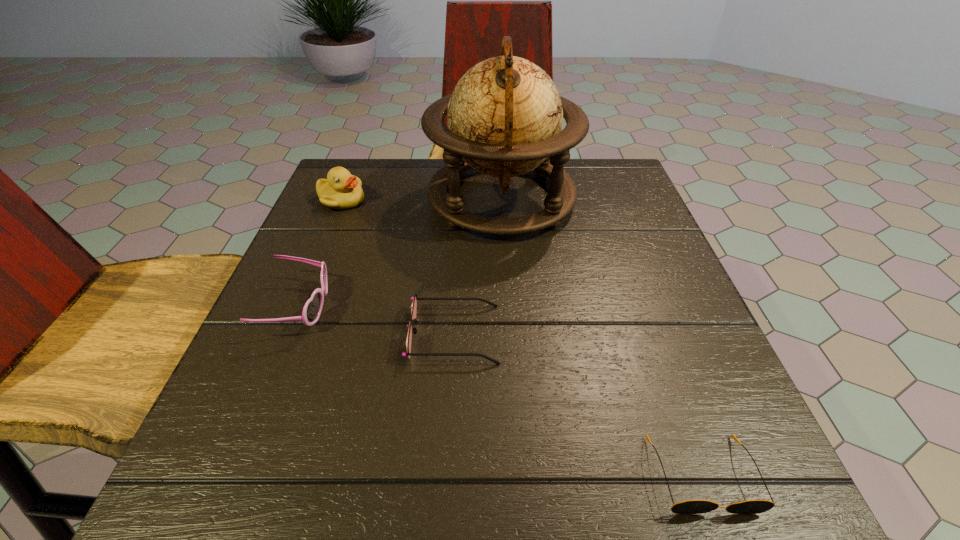
Identify the location of free space between the second sunglasses from right to left and the tallest sunglasses. (376, 320).

You are a GUI agent. You are given a task and a screenshot of the screen. Output one action in this format:
    pyautogui.click(x=<x>, y=<y>)
    Task: Click on the vacant space that's between the duckling and the third tallest object
    Image resolution: width=960 pixels, height=540 pixels.
    Given the screenshot: What is the action you would take?
    pyautogui.click(x=320, y=253)

The image size is (960, 540). I want to click on empty space that is in between the rightmost sunglasses and the second sunglasses from right to left, so click(578, 404).

Find the location of a particular element. This screenshot has width=960, height=540. free spot between the leftmost sunglasses and the second sunglasses from left to right is located at coordinates (376, 320).

Locate an element on the screen. The image size is (960, 540). free space between the second tallest object and the globe is located at coordinates (421, 199).

Where is `blank region between the nearest object and the globe`? blank region between the nearest object and the globe is located at coordinates (602, 336).

Point out which object is positioned as the third nearest to the duckling. Please provide its 2D coordinates. Your answer should be formatted as a tuple, i.e. [(x, y)], where the tuple contains the x and y coordinates of a point satisfying the conditions above.

[(414, 304)]

This screenshot has height=540, width=960. What are the coordinates of `object that stands as the fourth closest to the second sunglasses from right to left` in the screenshot? It's located at (341, 190).

Where is `sunglasses that is the closest to the second sunglasses from right to left`? This screenshot has height=540, width=960. sunglasses that is the closest to the second sunglasses from right to left is located at coordinates (311, 312).

Select which sunglasses is the closest to the second sunglasses from right to left. Please provide its 2D coordinates. Your answer should be formatted as a tuple, i.e. [(x, y)], where the tuple contains the x and y coordinates of a point satisfying the conditions above.

[(311, 312)]